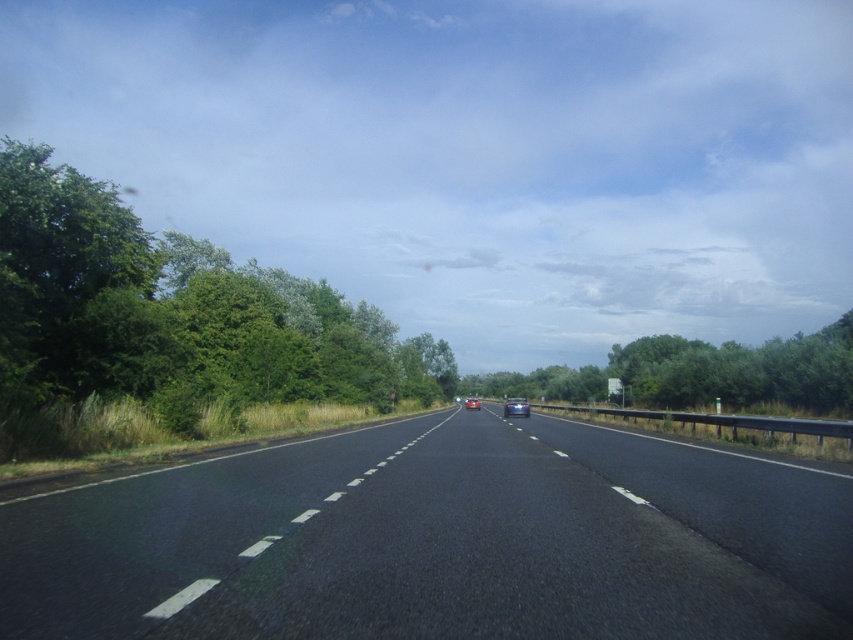
Who is more distant from viewer, [253,497] or [820,353]?

Positioned behind is point [820,353].

Find the location of a particular element. This screenshot has height=640, width=853. black asphalt highway at center is located at coordinates (438, 541).

This screenshot has width=853, height=640. What do you see at coordinates (438, 541) in the screenshot? I see `black asphalt highway at center` at bounding box center [438, 541].

Locate an element on the screen. The image size is (853, 640). black asphalt highway at center is located at coordinates point(438,541).

Between point (271, 508) and point (479, 403), which one is positioned behind?

The point (479, 403) is more distant.

Where is `black asphalt highway at center`? black asphalt highway at center is located at coordinates (438, 541).

Who is positioned more to the left, black asphalt highway at center or green leafy trees at left?

green leafy trees at left is more to the left.

Can you confirm if black asphalt highway at center is shorter than green leafy trees at left?

Yes, black asphalt highway at center is shorter than green leafy trees at left.

Between point (291, 600) and point (184, 422), which one is positioned behind?

Positioned behind is point (184, 422).

Identify the location of black asphalt highway at center. Image resolution: width=853 pixels, height=640 pixels. (438, 541).